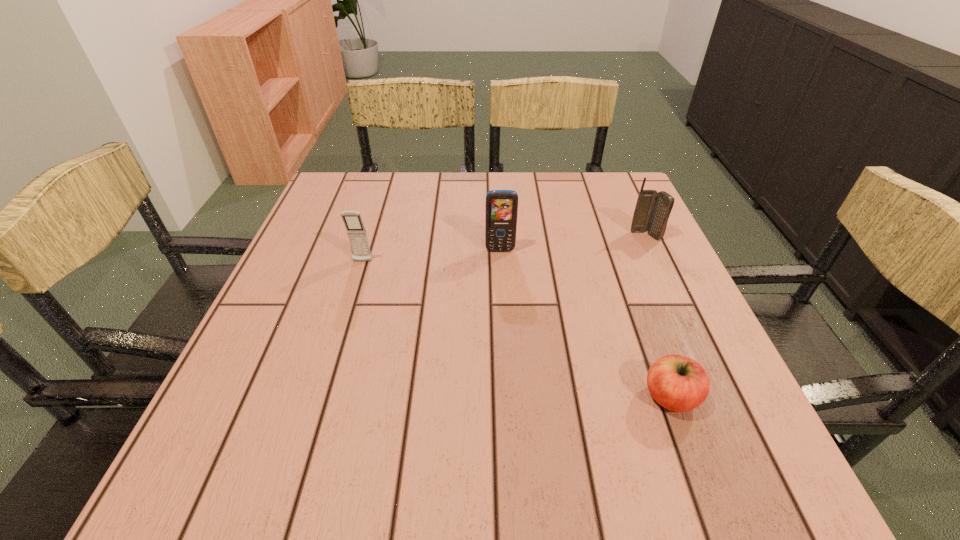
Find the location of `the second farthest cellular telephone`. the second farthest cellular telephone is located at coordinates (501, 209).

Locate an element on the screen. The width and height of the screenshot is (960, 540). the second cellular telephone from right to left is located at coordinates (501, 209).

Locate an element on the screen. This screenshot has width=960, height=540. the farthest cellular telephone is located at coordinates (652, 210).

Locate an element on the screen. The image size is (960, 540). the rightmost cellular telephone is located at coordinates click(x=652, y=210).

The width and height of the screenshot is (960, 540). Identify the location of the leftmost cellular telephone. (356, 231).

Where is `the nearest cellular telephone`? the nearest cellular telephone is located at coordinates (356, 231).

Where is `the nearest object`? the nearest object is located at coordinates (678, 383).

Where is `the shortest object`? This screenshot has height=540, width=960. the shortest object is located at coordinates (678, 383).

Where is `vacant space located on the screen of the second object from left to right`? Image resolution: width=960 pixels, height=540 pixels. vacant space located on the screen of the second object from left to right is located at coordinates (504, 331).

This screenshot has height=540, width=960. Identify the location of vacant position located 0.320m on the keyboard of the rightmost cellular telephone. (696, 345).